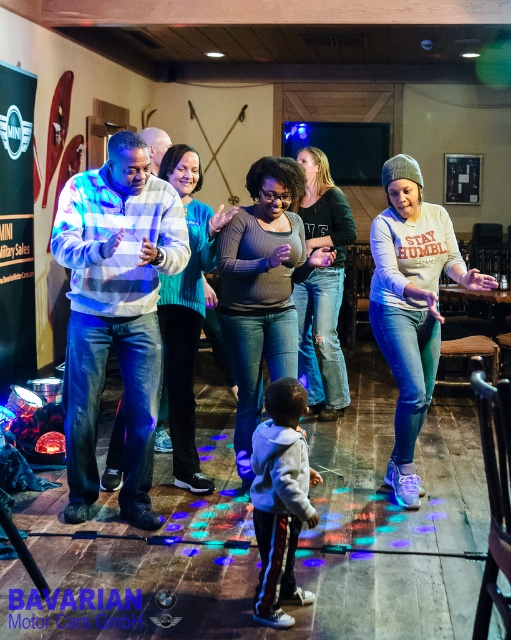
In the image of the lively indoor dance gathering with wooden floors and ski decorations, where exactly is the teal sweater at center located in terms of coordinates?

The teal sweater at center is located at point coordinates of 0.487 on the x axis and 0.364 on the y axis.

Based on the coordinates provided, where is the gray knit beanie at upper right located in the image?

The gray knit beanie at upper right is located at the coordinates point (411,305) in the image.

You are a photographer trying to capture a closeup of the gray knit beanie at upper right and the matte gray sweater at center. Which object should you focus on first if you want to adjust your camera focus from near to far?

You should focus on the gray knit beanie at upper right first because it is closer to the camera than the matte gray sweater at center.